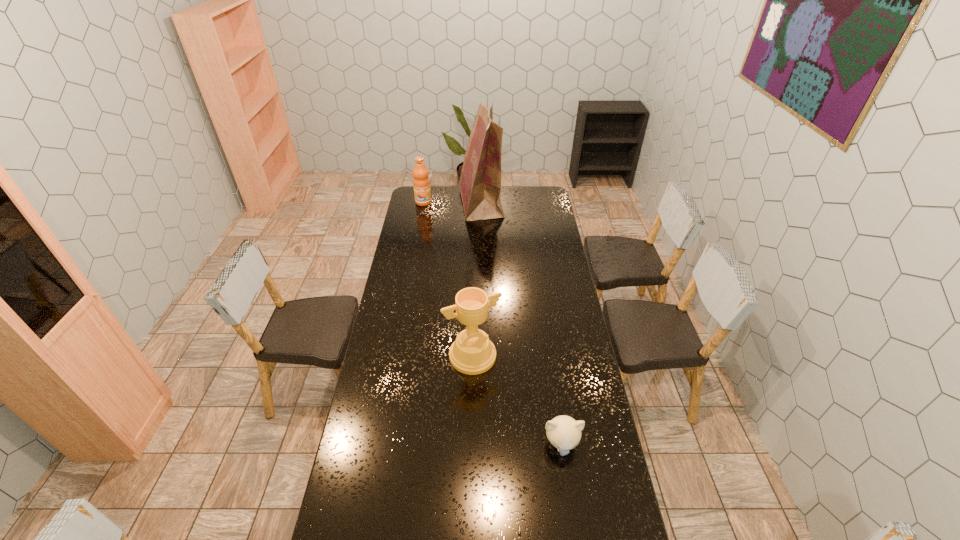
This screenshot has width=960, height=540. Identify the location of vacant region located 0.180m on the face of the shortest object. (572, 516).

The image size is (960, 540). What are the coordinates of `grocery bag that is at the far edge` in the screenshot? It's located at (480, 182).

Locate an element on the screen. Image resolution: width=960 pixels, height=540 pixels. fruit juice located at the far edge is located at coordinates (421, 182).

Locate an element on the screen. Image resolution: width=960 pixels, height=540 pixels. object that is at the left edge is located at coordinates (421, 182).

Locate an element on the screen. object that is at the right edge is located at coordinates (564, 433).

Find the location of `object that is at the far left corner`. object that is at the far left corner is located at coordinates (421, 182).

In the image, there is a desktop. Where is `vacant space at the far edge`? vacant space at the far edge is located at coordinates (504, 202).

Locate an element on the screen. vacant space at the left edge of the desktop is located at coordinates (368, 522).

This screenshot has height=540, width=960. In order to click on vacant area at the right edge in this screenshot , I will do `click(586, 388)`.

Find the location of a particular element. Image resolution: width=960 pixels, height=540 pixels. vacant area at the far right corner is located at coordinates (538, 195).